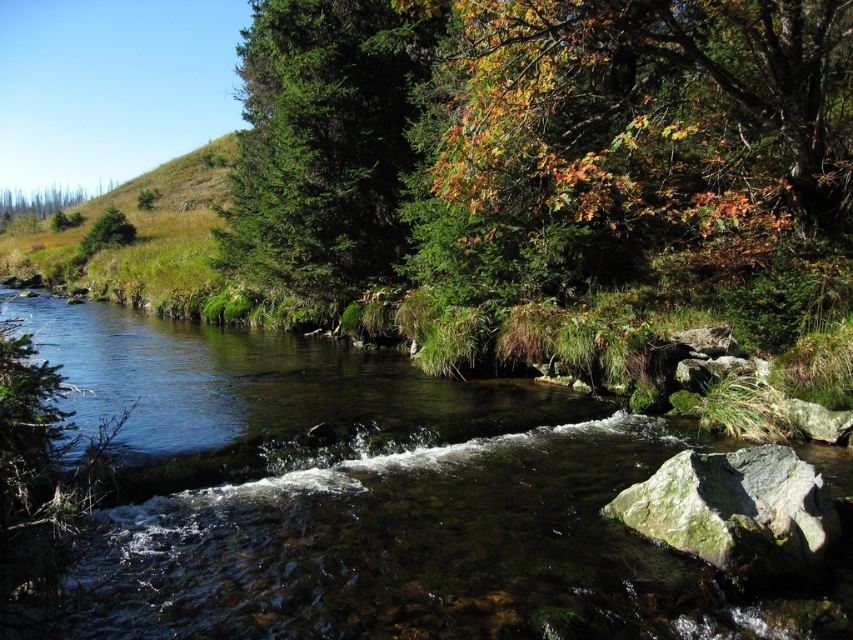
Question: Which of the following is the farthest from the observer?

Choices:
 (A) green mossy rock at lower right
 (B) clear water at center
 (C) green textured tree at center

Answer: (C)

Question: Among these points, which one is nearest to the camera?

Choices:
 (A) (466, 620)
 (B) (106, 209)
 (C) (788, 557)
 (D) (254, 160)

Answer: (A)

Question: Which object appears closest to the camera in this image?

Choices:
 (A) green matte tree at upper left
 (B) green textured tree at center

Answer: (B)

Question: Is green textured tree at center bigger than green matte tree at upper left?

Choices:
 (A) no
 (B) yes

Answer: (B)

Question: Can you confirm if green textured tree at center is positioned to the right of green matte tree at upper left?

Choices:
 (A) yes
 (B) no

Answer: (A)

Question: Is clear water at center smaller than green textured tree at center?

Choices:
 (A) yes
 (B) no

Answer: (A)